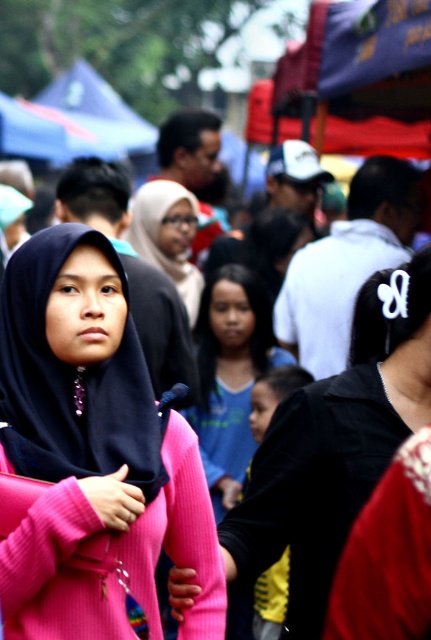
Does pink matte sweater at center have a larger size compared to pink ribbed sweater at center?

Incorrect, pink matte sweater at center is not larger than pink ribbed sweater at center.

Is pink matte sweater at center thinner than pink ribbed sweater at center?

Incorrect, pink matte sweater at center's width is not less than pink ribbed sweater at center's.

Is point (87, 532) closer to viewer compared to point (230, 440)?

Yes, point (87, 532) is in front of point (230, 440).

Locate an element on the screen. The width and height of the screenshot is (431, 640). pink matte sweater at center is located at coordinates (90, 456).